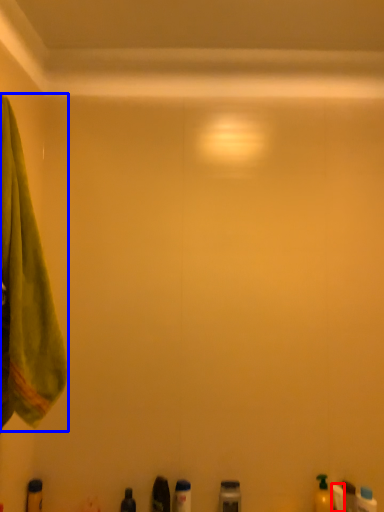
Question: Which of the following is the closest to the observer, toiletry (highlighted by a red box) or towel (highlighted by a blue box)?

Choices:
 (A) toiletry
 (B) towel

Answer: (B)